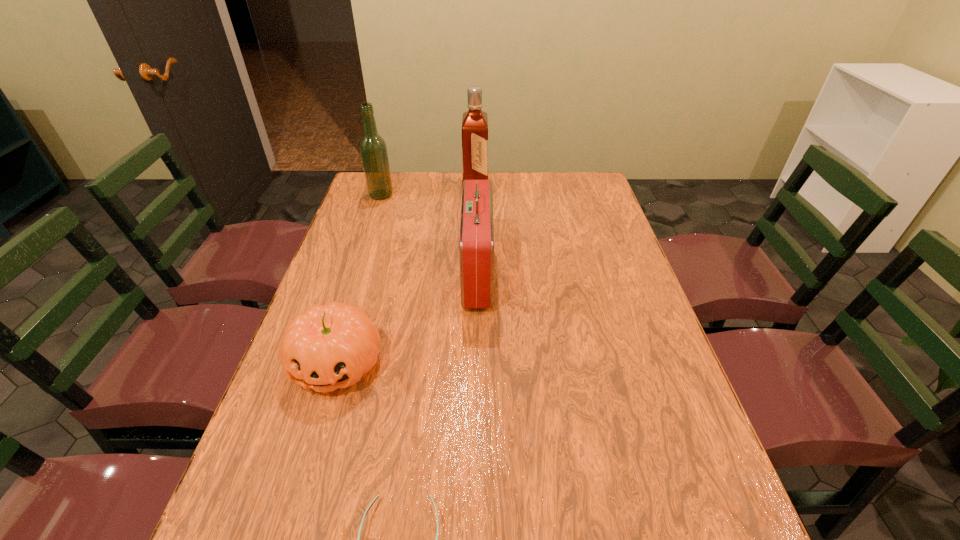
Find the location of a particular element. The width and height of the screenshot is (960, 540). liquor positioned at the left edge is located at coordinates (373, 148).

This screenshot has width=960, height=540. I want to click on pumpkin that is at the left edge, so click(331, 346).

The width and height of the screenshot is (960, 540). I want to click on object positioned at the far left corner, so click(373, 148).

The image size is (960, 540). In the image, there is a desktop. What are the coordinates of `free space at the far edge` in the screenshot? It's located at (544, 195).

Image resolution: width=960 pixels, height=540 pixels. Identify the location of blank area at the left edge. (378, 236).

The image size is (960, 540). I want to click on vacant space at the far right corner of the desktop, so click(572, 175).

Locate an element on the screen. The width and height of the screenshot is (960, 540). free space between the right liquor and the fourth tallest object is located at coordinates (406, 276).

The height and width of the screenshot is (540, 960). I want to click on empty space between the left liquor and the third nearest object, so point(429,234).

Where is `vacant point located between the fourth farthest object and the right liquor`? This screenshot has height=540, width=960. vacant point located between the fourth farthest object and the right liquor is located at coordinates (406, 276).

The image size is (960, 540). I want to click on free space between the fourth tallest object and the right liquor, so click(406, 276).